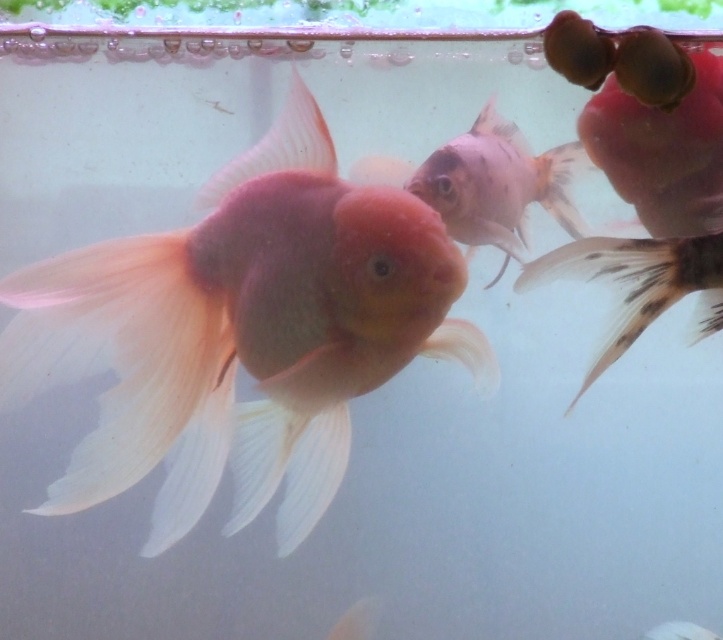
Question: Which object is positioned farthest from the matte pink goldfish at center?

Choices:
 (A) translucent pink fish at center
 (B) black spotted tail fin at right

Answer: (B)

Question: Is translucent pink fish at center further to camera compared to black spotted tail fin at right?

Choices:
 (A) no
 (B) yes

Answer: (B)

Question: Does translucent pink fish at center lie behind black spotted tail fin at right?

Choices:
 (A) yes
 (B) no

Answer: (A)

Question: Among these objects, which one is farthest from the camera?

Choices:
 (A) black spotted tail fin at right
 (B) translucent pink fish at center

Answer: (B)

Question: Is translucent pink fish at center to the left of black spotted tail fin at right from the viewer's perspective?

Choices:
 (A) no
 (B) yes

Answer: (B)

Question: Which point appears farthest from the camera in this image?

Choices:
 (A) (440, 160)
 (B) (80, 456)
 (C) (604, 353)

Answer: (A)